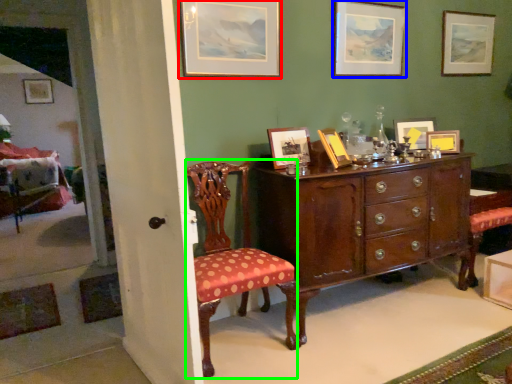
Question: Based on their relative distances, which object is farther from picture frame (highlighted by a red box)? Choose from picture frame (highlighted by a blue box) and chair (highlighted by a green box).

Choices:
 (A) picture frame
 (B) chair

Answer: (B)